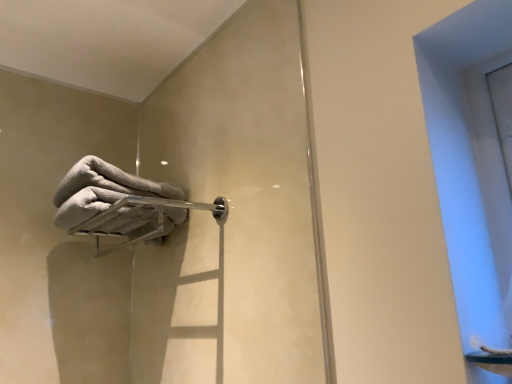
Question: Should I look upward or downward to see transparent glass window at upper right?

Choices:
 (A) down
 (B) up

Answer: (A)

Question: Is the position of transparent glass window at upper right less distant than that of silver metallic towel bar at upper left?

Choices:
 (A) yes
 (B) no

Answer: (A)

Question: Considering the relative sizes of transparent glass window at upper right and silver metallic towel bar at upper left in the image provided, is transparent glass window at upper right thinner than silver metallic towel bar at upper left?

Choices:
 (A) no
 (B) yes

Answer: (B)

Question: Would you say transparent glass window at upper right contains silver metallic towel bar at upper left?

Choices:
 (A) no
 (B) yes

Answer: (A)

Question: Is there a large distance between transparent glass window at upper right and silver metallic towel bar at upper left?

Choices:
 (A) no
 (B) yes

Answer: (A)

Question: Can you confirm if transparent glass window at upper right is wider than silver metallic towel bar at upper left?

Choices:
 (A) yes
 (B) no

Answer: (B)

Question: From the image's perspective, does transparent glass window at upper right appear lower than silver metallic towel bar at upper left?

Choices:
 (A) yes
 (B) no

Answer: (B)

Question: From the image's perspective, does transparent glass window at upper right appear higher than white fluffy towel at upper left?

Choices:
 (A) no
 (B) yes

Answer: (A)

Question: Considering the relative sizes of transparent glass window at upper right and white fluffy towel at upper left in the image provided, is transparent glass window at upper right smaller than white fluffy towel at upper left?

Choices:
 (A) yes
 (B) no

Answer: (B)

Question: Is transparent glass window at upper right in contact with white fluffy towel at upper left?

Choices:
 (A) no
 (B) yes

Answer: (A)

Question: Would you say white fluffy towel at upper left is part of transparent glass window at upper right's contents?

Choices:
 (A) no
 (B) yes

Answer: (A)

Question: Is transparent glass window at upper right positioned behind white fluffy towel at upper left?

Choices:
 (A) yes
 (B) no

Answer: (B)

Question: Can we say transparent glass window at upper right lies outside white fluffy towel at upper left?

Choices:
 (A) no
 (B) yes

Answer: (B)

Question: Considering the relative sizes of white fluffy towel at upper left and silver metallic towel bar at upper left in the image provided, is white fluffy towel at upper left shorter than silver metallic towel bar at upper left?

Choices:
 (A) no
 (B) yes

Answer: (A)